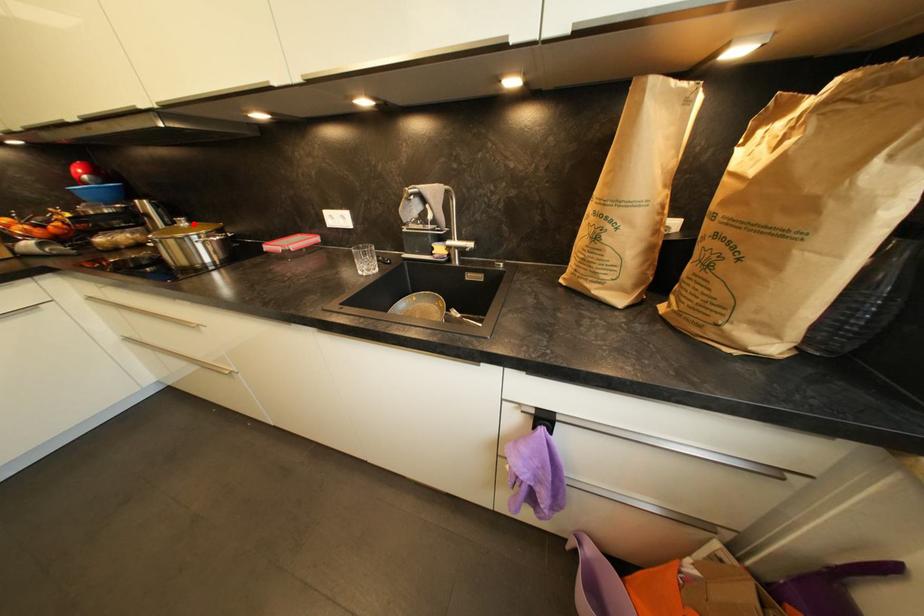
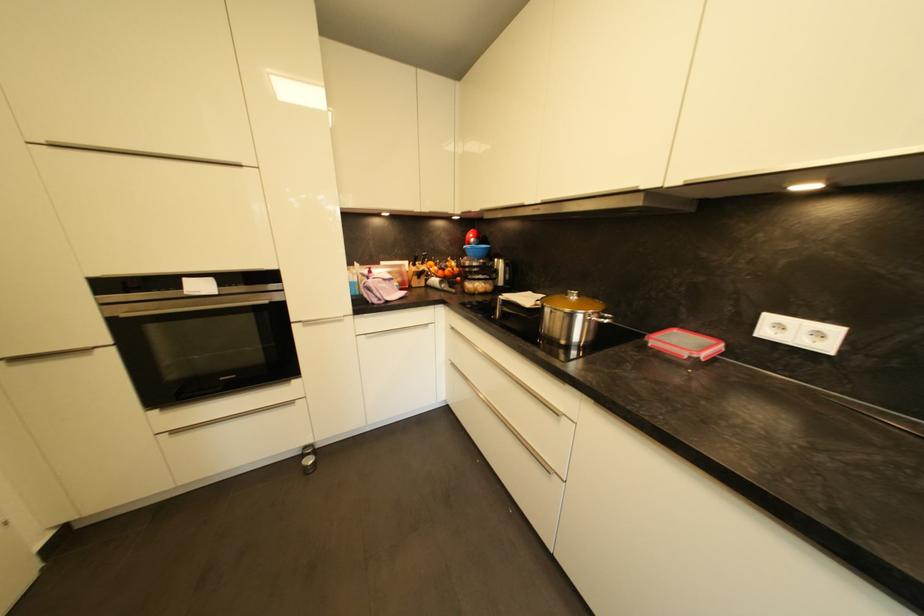
The point at the highlighted location is marked in the first image. Where is the corresponding point in the second image?

(584, 298)